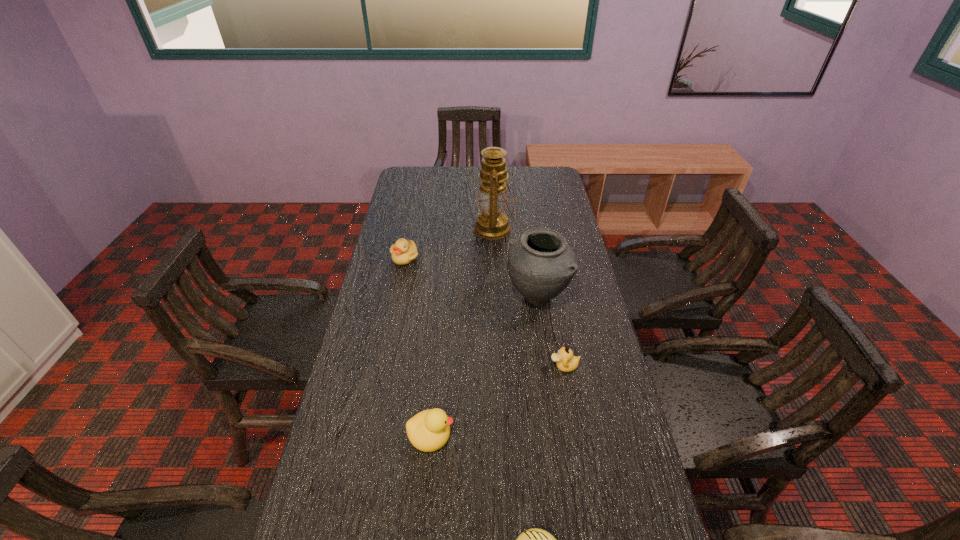
Where is `free space located on the left of the farthest object`? free space located on the left of the farthest object is located at coordinates (427, 229).

Where is `vacant area situated 0.230m on the front of the fifth shortest object`? vacant area situated 0.230m on the front of the fifth shortest object is located at coordinates (550, 380).

I want to click on free space located on the beak of the leftmost object, so click(x=400, y=280).

The image size is (960, 540). What are the coordinates of `free point located 0.100m on the face of the second nearest duckling` in the screenshot? It's located at [x=494, y=434].

At what (x,y) coordinates should I click in order to perform the action: click on blank space located 0.310m on the face of the rightmost duckling. Please return your answer as a coordinate pair (x, y). Looking at the image, I should click on (442, 366).

Find the location of a particular element. free space located on the face of the rightmost duckling is located at coordinates (508, 366).

What are the coordinates of `free region located on the face of the rightmost duckling` in the screenshot? It's located at (497, 366).

Where is `object that is at the left edge`? object that is at the left edge is located at coordinates (404, 252).

What are the coordinates of `urn that is at the right edge` in the screenshot? It's located at (541, 264).

Locate an element on the screen. The width and height of the screenshot is (960, 540). duckling that is at the right edge is located at coordinates (565, 361).